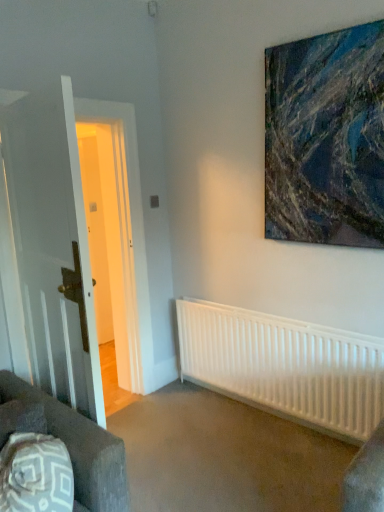
The height and width of the screenshot is (512, 384). I want to click on empty space that is ontop of white matte radiator at lower center (from a real-world perspective), so click(x=242, y=312).